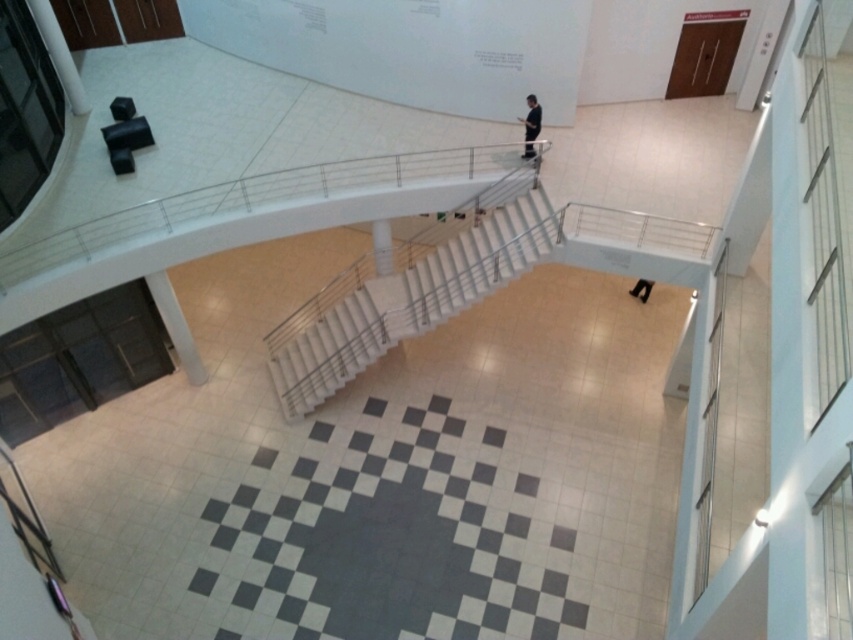
You are a security guard in the atrium and need to locate the black smooth suit at center. According to the coordinate system where the bottom left corner is the origin, is the suit closer to the left or right side of the atrium?

The black smooth suit at center is located at point (531, 118). Since the x coordinate is 0.186, which is closer to 0, the left side, the suit is closer to the left side of the atrium.

You are a delivery person carrying a heavy box and need to climb the white glossy stairs at center. The box is as tall as the black leather shoes at lower center. Will the box fit through the staircase without hitting the top of the stairs?

The white glossy stairs at center is taller than the black leather shoes at lower center. Since the box is as tall as the black leather shoes at lower center, it will fit through the staircase without hitting the top.

You are standing at the entrance of the atrium and want to reach the upper platform. The white glossy stairs at center are your only path. Can you confirm their exact location relative to the entrance?

The white glossy stairs at center are positioned at coordinates approximately 0.470 on the x and 0.484 on the y axis, making them centrally located in the atrium space.